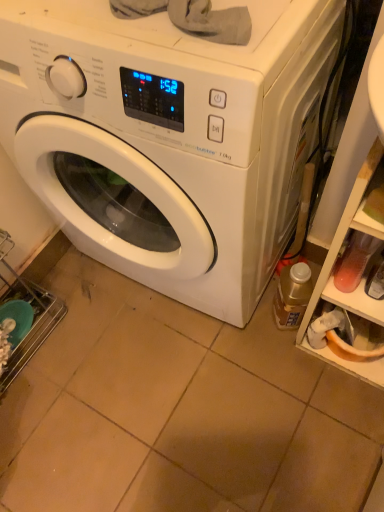
In order to click on vacant space in front of white glossy washing machine at center in this screenshot , I will do `click(190, 404)`.